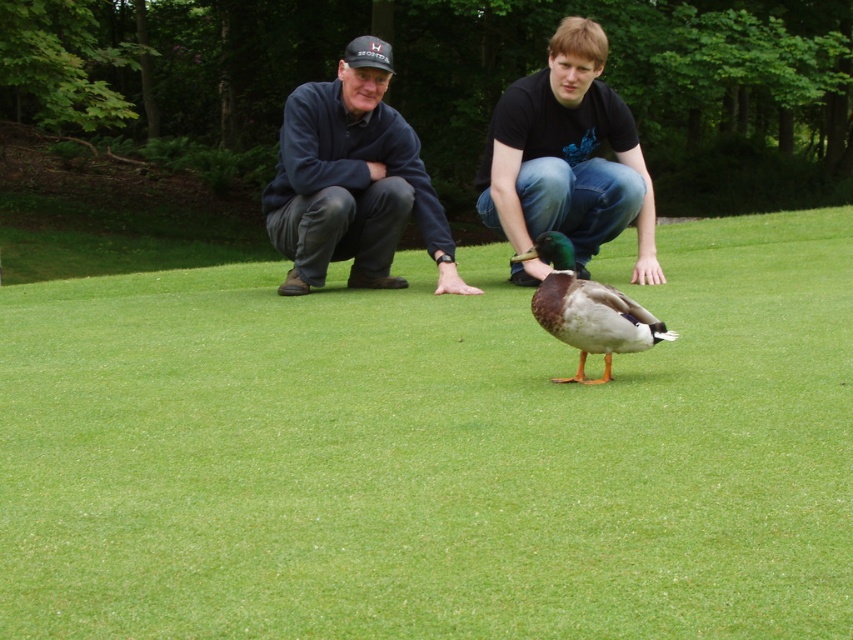
You are a gardener who needs to place a 16 inch long garden tool between the green grass at center and the green matte duck at center. Can you fit it there without moving either object?

The distance between the green grass at center and the green matte duck at center is 17.31 inches, so yes, the 16 inch long garden tool can fit there since it is shorter than the available space.